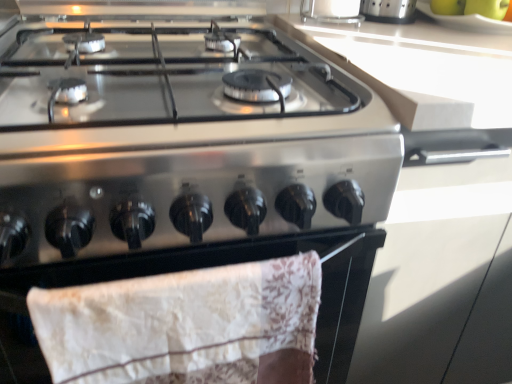
Question: From a real-world perspective, is green matte bananas at upper right, marked as the 1th fruit in a left-to-right arrangement, positioned above or below clear glass container at upper center?

Choices:
 (A) above
 (B) below

Answer: (B)

Question: Considering the positions of green matte bananas at upper right, marked as the 1th fruit in a left-to-right arrangement, and clear glass container at upper center in the image, is green matte bananas at upper right, marked as the 1th fruit in a left-to-right arrangement, bigger or smaller than clear glass container at upper center?

Choices:
 (A) big
 (B) small

Answer: (B)

Question: Which of these objects is positioned closest to the clear glass container at upper center?

Choices:
 (A) stainless steel gas stove at center
 (B) green matte bananas at upper right, marked as the 2th fruit in a right-to-left arrangement
 (C) green matte apple at upper right, placed as the 1th fruit when sorted from right to left
 (D) white lace towel at lower center

Answer: (B)

Question: Which object is positioned closest to the green matte apple at upper right, placed as the 1th fruit when sorted from right to left?

Choices:
 (A) stainless steel gas stove at center
 (B) clear glass container at upper center
 (C) white lace towel at lower center
 (D) green matte bananas at upper right, marked as the 1th fruit in a left-to-right arrangement

Answer: (D)